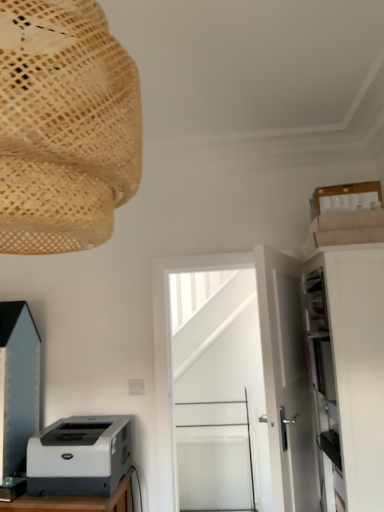
Question: From the image's perspective, is white plastic printer at lower left located above white matte door at center, the 2th door in the back-to-front sequence?

Choices:
 (A) yes
 (B) no

Answer: (B)

Question: Is white plastic printer at lower left located outside white matte door at center, marked as the first door in a front-to-back arrangement?

Choices:
 (A) yes
 (B) no

Answer: (A)

Question: Can you confirm if white plastic printer at lower left is shorter than white matte door at center, the 2th door in the back-to-front sequence?

Choices:
 (A) no
 (B) yes

Answer: (B)

Question: From a real-world perspective, does white plastic printer at lower left stand above white matte door at center, the 2th door in the back-to-front sequence?

Choices:
 (A) no
 (B) yes

Answer: (A)

Question: Is white plastic printer at lower left facing away from white matte door at center, the 2th door in the back-to-front sequence?

Choices:
 (A) no
 (B) yes

Answer: (A)

Question: Is point (276, 458) positioned closer to the camera than point (309, 423)?

Choices:
 (A) closer
 (B) farther

Answer: (A)

Question: Is white matte door at center, the 2th door in the back-to-front sequence, wider or thinner than white matte door at center, which is the second door from front to back?

Choices:
 (A) wide
 (B) thin

Answer: (B)

Question: In terms of height, does white matte door at center, the 2th door in the back-to-front sequence, look taller or shorter compared to white matte door at center, which is the second door from front to back?

Choices:
 (A) tall
 (B) short

Answer: (B)

Question: From the image's perspective, is white matte door at center, the 2th door in the back-to-front sequence, located above or below white matte door at center, which is the 1th door in back-to-front order?

Choices:
 (A) below
 (B) above

Answer: (B)

Question: In the image, is matte black cabinet at lower left, which ranks as the 2th cabinetry in right-to-left order, positioned in front of or behind white matte cabinet at right, the first cabinetry positioned from the right?

Choices:
 (A) front
 (B) behind

Answer: (B)

Question: Is matte black cabinet at lower left, the first cabinetry in the left-to-right sequence, situated inside white matte cabinet at right, the first cabinetry positioned from the right, or outside?

Choices:
 (A) inside
 (B) outside

Answer: (B)

Question: Considering the positions of matte black cabinet at lower left, which ranks as the 2th cabinetry in right-to-left order, and white matte cabinet at right, which is the 2th cabinetry from left to right, in the image, is matte black cabinet at lower left, which ranks as the 2th cabinetry in right-to-left order, bigger or smaller than white matte cabinet at right, which is the 2th cabinetry from left to right,?

Choices:
 (A) big
 (B) small

Answer: (B)

Question: Is point (6, 390) closer or farther from the camera than point (329, 357)?

Choices:
 (A) farther
 (B) closer

Answer: (A)

Question: From a real-world perspective, is matte black cabinet at lower left, the first cabinetry in the left-to-right sequence, positioned above or below white plastic printer at lower left?

Choices:
 (A) above
 (B) below

Answer: (A)

Question: Looking at the image, does matte black cabinet at lower left, which ranks as the 2th cabinetry in right-to-left order, seem bigger or smaller compared to white plastic printer at lower left?

Choices:
 (A) big
 (B) small

Answer: (A)